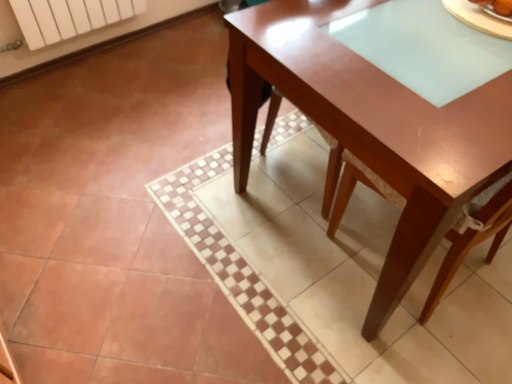
Measure the distance between point (450, 173) and camera.

Point (450, 173) is 32.87 inches away from camera.

I want to click on smooth brown bread at upper right, so click(x=496, y=6).

Find the location of `glossy wood table at center`. glossy wood table at center is located at coordinates (371, 127).

Which of these two, glossy wood table at center or smooth brown bread at upper right, is bigger?

Bigger between the two is glossy wood table at center.

Which is behind, point (292, 28) or point (499, 7)?

Point (499, 7)

From the picture: Which of these two, glossy wood table at center or smooth brown bread at upper right, is wider?

glossy wood table at center is wider.

Does point (71, 9) lie in front of point (488, 5)?

No, it is behind (488, 5).

Which object is thinner, white matte radiator at upper left or smooth brown bread at upper right?

smooth brown bread at upper right.

Does white matte radiator at upper left turn towards smooth brown bread at upper right?

Yes.

From the image's perspective, is white matte radiator at upper left over smooth brown bread at upper right?

Indeed, from the image's perspective, white matte radiator at upper left is shown above smooth brown bread at upper right.

From a real-world perspective, is smooth brown bread at upper right over glossy wood table at center?

Yes, from a real-world perspective, smooth brown bread at upper right is above glossy wood table at center.

Which object is further away from the camera taking this photo, smooth brown bread at upper right or glossy wood table at center?

smooth brown bread at upper right is further from the camera.

Are smooth brown bread at upper right and glossy wood table at center making contact?

There is a gap between smooth brown bread at upper right and glossy wood table at center.

Considering the relative positions of smooth brown bread at upper right and white matte radiator at upper left in the image provided, is smooth brown bread at upper right to the left or to the right of white matte radiator at upper left?

smooth brown bread at upper right is positioned on white matte radiator at upper left's right side.

Is smooth brown bread at upper right wider than white matte radiator at upper left?

No, smooth brown bread at upper right is not wider than white matte radiator at upper left.

How much distance is there between smooth brown bread at upper right and white matte radiator at upper left?

The distance of smooth brown bread at upper right from white matte radiator at upper left is 1.86 meters.

Which of these two, smooth brown bread at upper right or white matte radiator at upper left, is smaller?

smooth brown bread at upper right is smaller.

From a real-world perspective, is glossy wood table at center physically above white matte radiator at upper left?

Yes, from a real-world perspective, glossy wood table at center is above white matte radiator at upper left.

Between glossy wood table at center and white matte radiator at upper left, which one has larger size?

Bigger between the two is glossy wood table at center.

From the image's perspective, which is below, glossy wood table at center or white matte radiator at upper left?

glossy wood table at center appears lower in the image.

Is point (323, 7) closer to camera compared to point (122, 17)?

That is True.

Considering the positions of objects white matte radiator at upper left and glossy wood table at center in the image provided, who is more to the left, white matte radiator at upper left or glossy wood table at center?

white matte radiator at upper left is more to the left.

Which is behind, point (131, 7) or point (487, 125)?

The point (131, 7) is behind.

From the image's perspective, is white matte radiator at upper left located beneath glossy wood table at center?

Incorrect, from the image's perspective, white matte radiator at upper left is higher than glossy wood table at center.

I want to click on food located above the glossy wood table at center (from a real-world perspective), so click(x=496, y=6).

The width and height of the screenshot is (512, 384). In order to click on radiator below the smooth brown bread at upper right (from a real-world perspective) in this screenshot , I will do `click(69, 17)`.

Considering their positions, is smooth brown bread at upper right positioned closer to glossy wood table at center than white matte radiator at upper left?

smooth brown bread at upper right lies closer to glossy wood table at center than the other object.

From the image, which object appears to be farther from white matte radiator at upper left, glossy wood table at center or smooth brown bread at upper right?

Among the two, smooth brown bread at upper right is located further to white matte radiator at upper left.

From the image, which object appears to be farther from smooth brown bread at upper right, glossy wood table at center or white matte radiator at upper left?

The object further to smooth brown bread at upper right is white matte radiator at upper left.

From the image, which object appears to be farther from smooth brown bread at upper right, white matte radiator at upper left or glossy wood table at center?

white matte radiator at upper left is further to smooth brown bread at upper right.

Estimate the real-world distances between objects in this image. Which object is closer to glossy wood table at center, white matte radiator at upper left or smooth brown bread at upper right?

smooth brown bread at upper right lies closer to glossy wood table at center than the other object.

Looking at this image, from the image, which object appears to be nearer to white matte radiator at upper left, smooth brown bread at upper right or glossy wood table at center?

Among the two, glossy wood table at center is located nearer to white matte radiator at upper left.

Find the location of a particular element. The height and width of the screenshot is (384, 512). food located between white matte radiator at upper left and glossy wood table at center in the left-right direction is located at coordinates (496, 6).